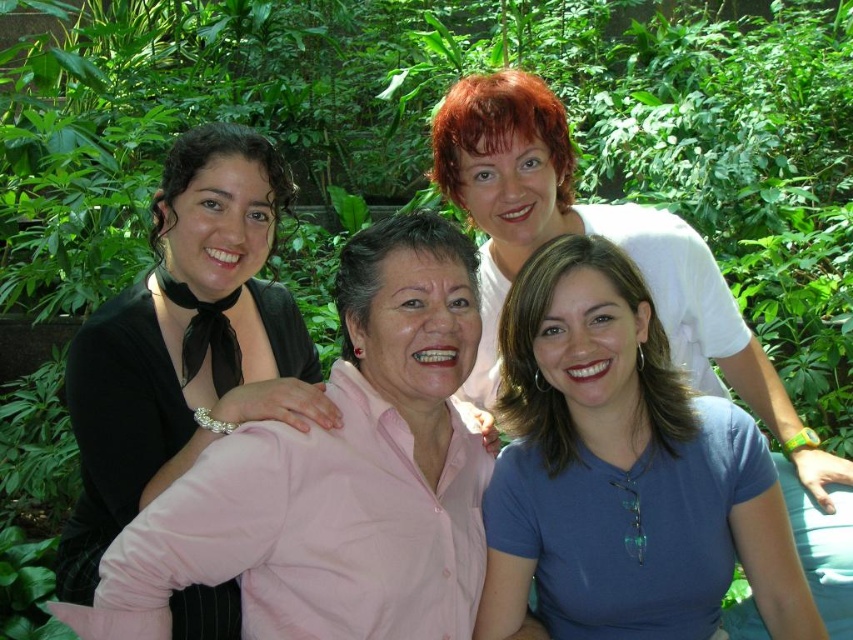
Question: Which point appears closest to the camera in this image?

Choices:
 (A) (624, 397)
 (B) (236, 385)
 (C) (477, 154)

Answer: (A)

Question: Among these objects, which one is nearest to the camera?

Choices:
 (A) blue matte shirt at lower right
 (B) white matte shirt at upper center
 (C) black satin blouse at left

Answer: (C)

Question: Which point is closer to the camera?

Choices:
 (A) black satin blouse at left
 (B) blue matte shirt at lower right

Answer: (A)

Question: Considering the relative positions of black satin blouse at left and white matte shirt at upper center in the image provided, where is black satin blouse at left located with respect to white matte shirt at upper center?

Choices:
 (A) left
 (B) right

Answer: (A)

Question: In this image, where is blue matte shirt at lower right located relative to black satin blouse at left?

Choices:
 (A) below
 (B) above

Answer: (A)

Question: Can you confirm if black satin blouse at left is positioned below white matte shirt at upper center?

Choices:
 (A) yes
 (B) no

Answer: (A)